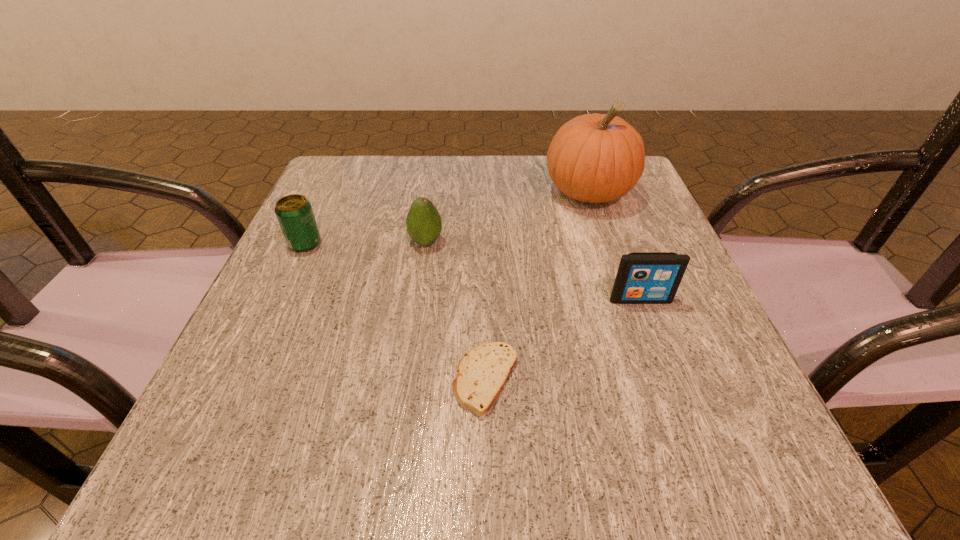
The image size is (960, 540). Find the location of `vacant space at the far left corner of the desktop`. vacant space at the far left corner of the desktop is located at coordinates (391, 172).

At what (x,y) coordinates should I click in order to perform the action: click on free region at the far right corner of the desktop. Please return your answer as a coordinate pair (x, y). Image resolution: width=960 pixels, height=540 pixels. Looking at the image, I should click on (633, 199).

Locate an element on the screen. The width and height of the screenshot is (960, 540). free location at the near right corner of the desktop is located at coordinates (771, 436).

Identify the location of vacant area between the shortest object and the leftmost object. (396, 312).

Locate an element on the screen. Image resolution: width=960 pixels, height=540 pixels. free spot between the farthest object and the pita bread is located at coordinates (537, 286).

The width and height of the screenshot is (960, 540). I want to click on free space that is in between the nearest object and the avocado, so click(456, 311).

At what (x,y) coordinates should I click in order to perform the action: click on free area in between the leftmost object and the avocado. Please return your answer as a coordinate pair (x, y). Looking at the image, I should click on (366, 242).

At what (x,y) coordinates should I click in order to perform the action: click on vacant area that lies between the avocado and the nearest object. Please return your answer as a coordinate pair (x, y). Image resolution: width=960 pixels, height=540 pixels. Looking at the image, I should click on (456, 311).

Where is `vacant area that lies between the avocado and the pumpkin`? vacant area that lies between the avocado and the pumpkin is located at coordinates (507, 217).

Where is `blank region between the second object from left to right and the iPod`? Image resolution: width=960 pixels, height=540 pixels. blank region between the second object from left to right and the iPod is located at coordinates (533, 271).